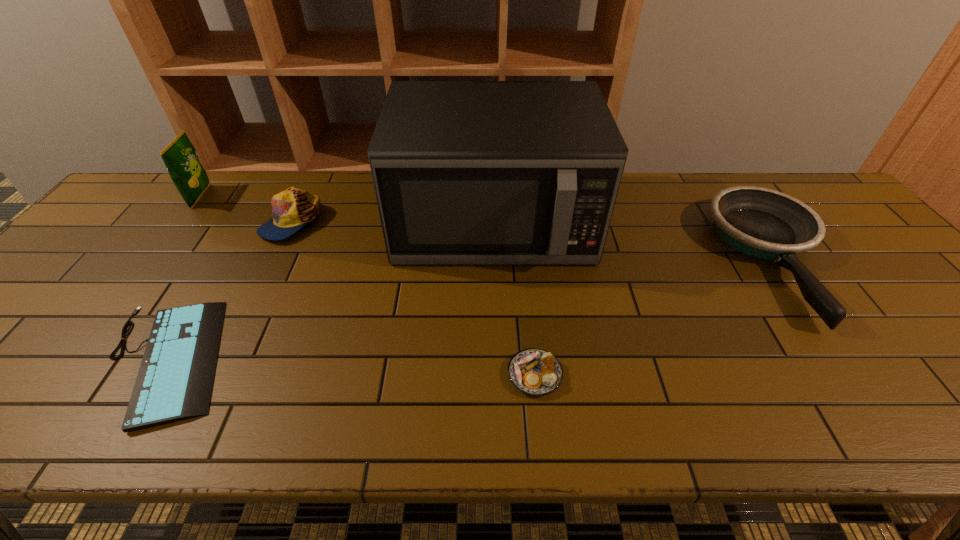
Locate which object ranks second in proximity to the cap. Please provide its 2D coordinates. Your answer should be formatted as a tuple, i.e. [(x, y)], where the tuple contains the x and y coordinates of a point satisfying the conditions above.

[(180, 157)]

Where is `object identified as the fifth closest to the fifth tallest object`? object identified as the fifth closest to the fifth tallest object is located at coordinates (180, 157).

Locate an element on the screen. free spot that satisfies the following two spatial constraints: 1. on the bill of the pastry; 2. on the right side of the third tallest object is located at coordinates (217, 375).

Image resolution: width=960 pixels, height=540 pixels. Find the location of `free space that satisfies the following two spatial constraints: 1. on the bill of the cap; 2. on the left side of the second shortest object`. free space that satisfies the following two spatial constraints: 1. on the bill of the cap; 2. on the left side of the second shortest object is located at coordinates (217, 375).

Identify the location of vacant space that satisfies the following two spatial constraints: 1. on the bill of the second shortest object; 2. on the right side of the cap. (217, 375).

Locate an element on the screen. The height and width of the screenshot is (540, 960). free space that satisfies the following two spatial constraints: 1. on the front-facing side of the tallest object; 2. on the left side of the pastry is located at coordinates pos(498,375).

Locate an element on the screen. free space that satisfies the following two spatial constraints: 1. on the front-facing side of the crisp (potato chip); 2. on the left side of the shortest object is located at coordinates (73, 360).

Where is `free spot that satisfies the following two spatial constraints: 1. on the front-facing side of the computer keyboard; 2. on the left side of the crisp (potato chip)`? This screenshot has height=540, width=960. free spot that satisfies the following two spatial constraints: 1. on the front-facing side of the computer keyboard; 2. on the left side of the crisp (potato chip) is located at coordinates (73, 360).